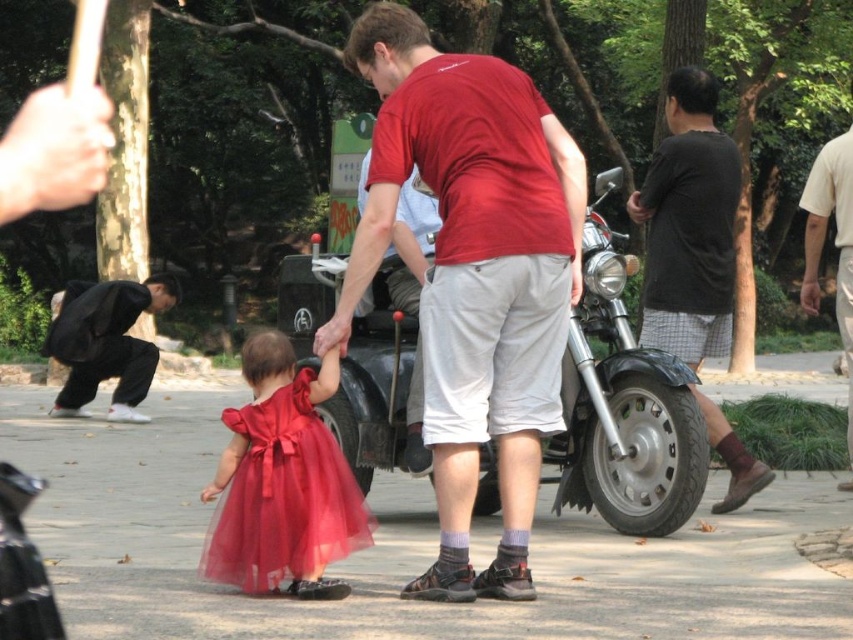
You are a fashion designer observing the scene and want to create a new outfit combining the matte tulle dress at center and the black cotton pants at left. Which item should you choose as the base for the outfit to ensure proper fit and proportion?

The black cotton pants at left should be chosen as the base since the matte tulle dress at center is narrower, making the pants a better foundation for maintaining proportions and ensuring a proper fit.

You are standing at point [115,282] and want to walk to point [534,595]. Is the destination point in front of you?

Yes, point [534,595] is in front of point [115,282] according to the coordinates provided.

What are the coordinates of the matte tulle dress at center?

The matte tulle dress at center is located at point [282,493].